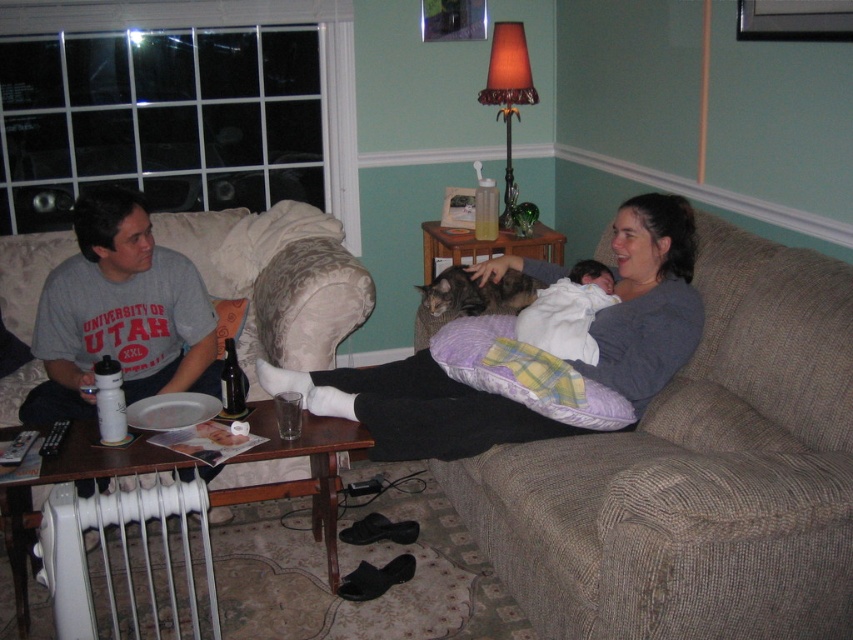
You are a guest entering the living room and want to sit on the beige fabric couch at center. Where should you look to find the couch relative to the orange fabric lampshade at upper center?

The beige fabric couch at center is to the right of the orange fabric lampshade at upper center, so you should look to the right side of the orange fabric lampshade at upper center to find the couch.

You are a photographer trying to capture a candid shot of the gray soft fabric woman at center and the gray fur cat at center. Since you want to ensure both subjects are in focus, which one should you focus on first to account for their positions?

The gray soft fabric woman at center is located below gray fur cat at center, so you should focus on the gray fur cat at center first as it is closer to the camera.

Consider the image. You are a photographer taking a photo of the gray soft fabric woman at center and the gray fur cat at center. Which one should you focus on if you want to capture the subject that is taller?

The gray soft fabric woman at center is taller than the gray fur cat at center, so you should focus on the gray soft fabric woman at center to capture the taller subject.